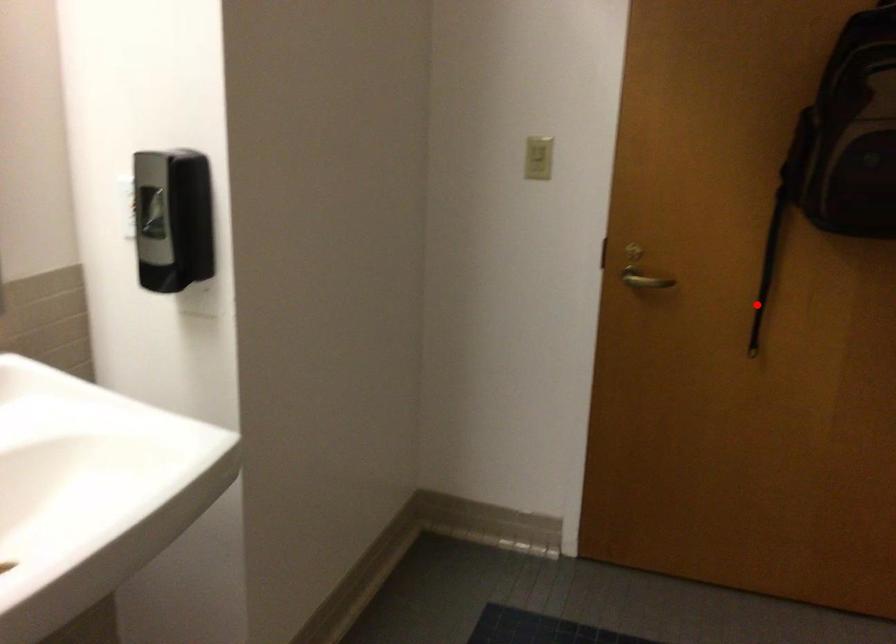
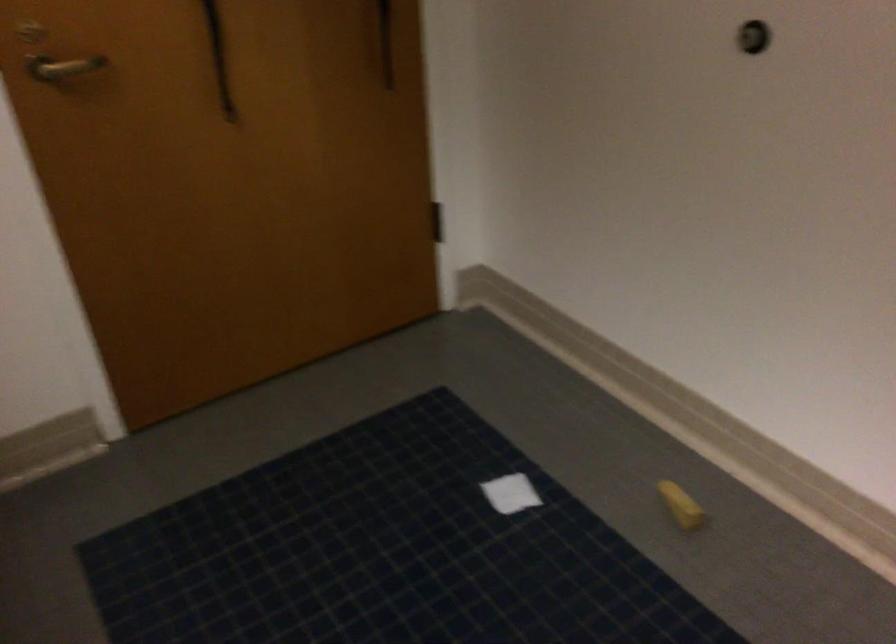
Question: A red point is marked in image1. In image2, is the corresponding 3D point closer to the camera or farther? Reply with the corresponding letter.

Choices:
 (A) The corresponding 3D point is closer.
 (B) The corresponding 3D point is farther.

Answer: (A)